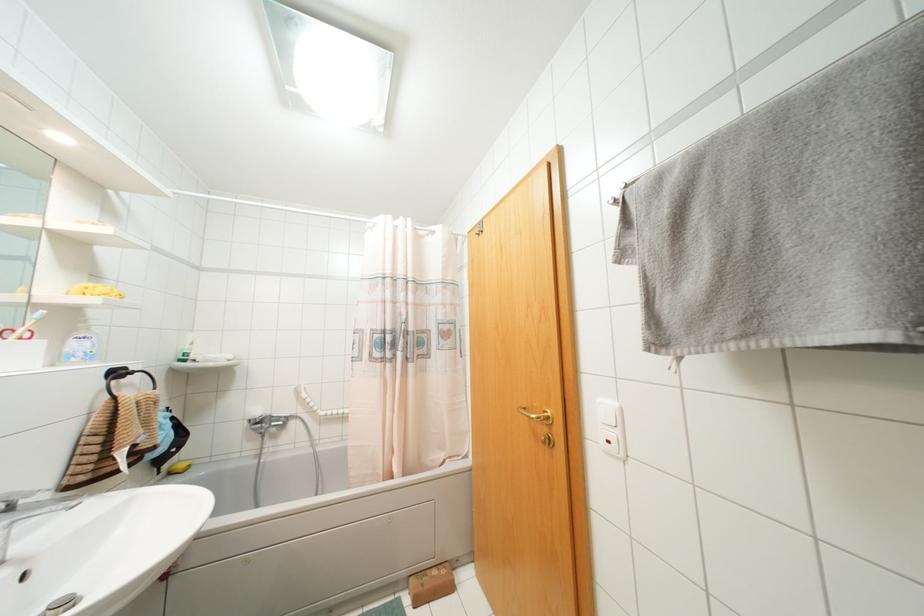
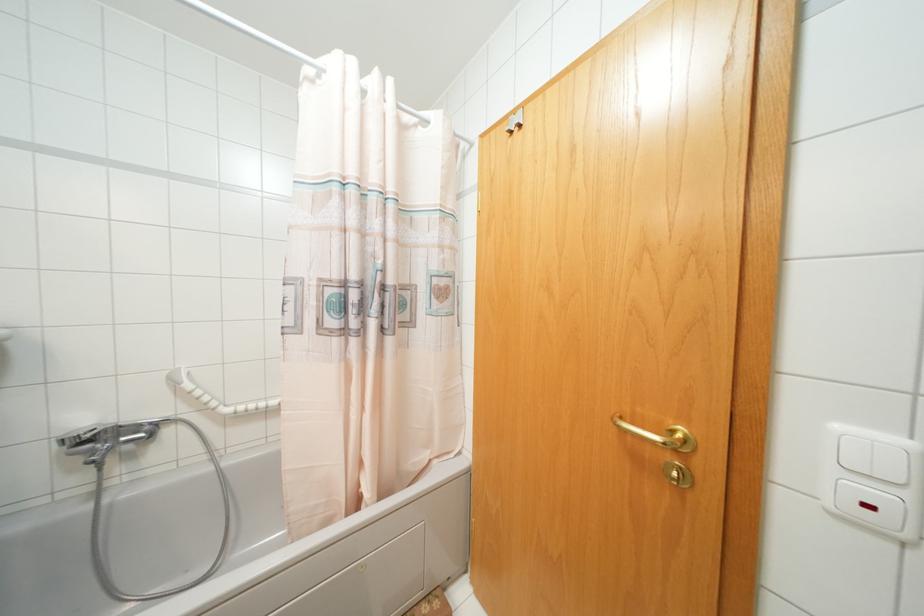
In the second image, find the point that corresponds to point (546, 416) in the first image.

(686, 440)